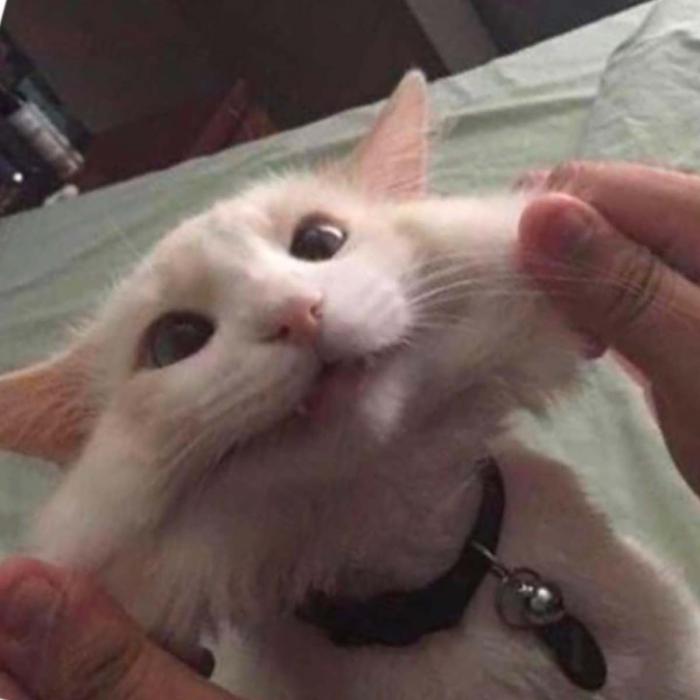
This screenshot has width=700, height=700. Find the location of `bottle`. bottle is located at coordinates (31, 125).